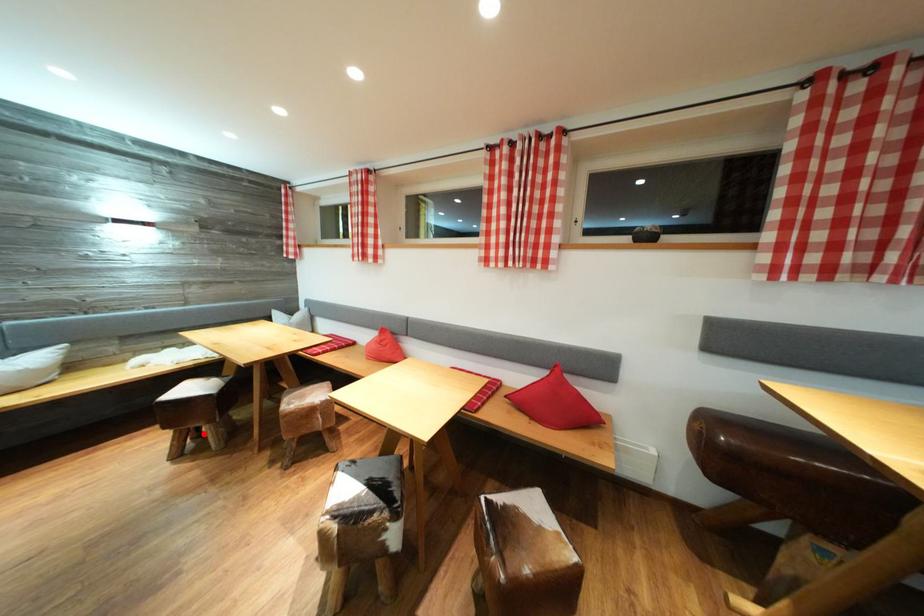
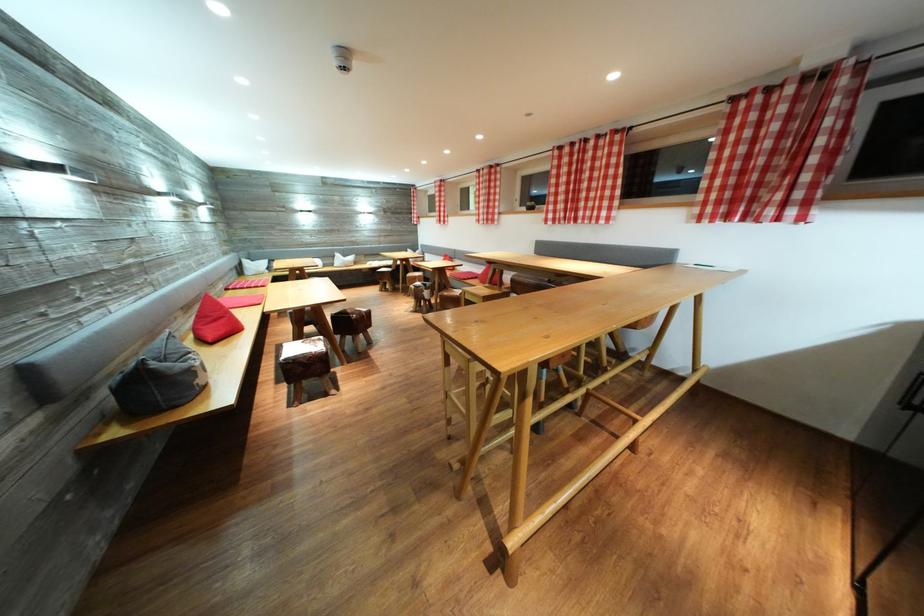
Find the pixel in the second image that matches the highlighted location in the first image.

(393, 289)